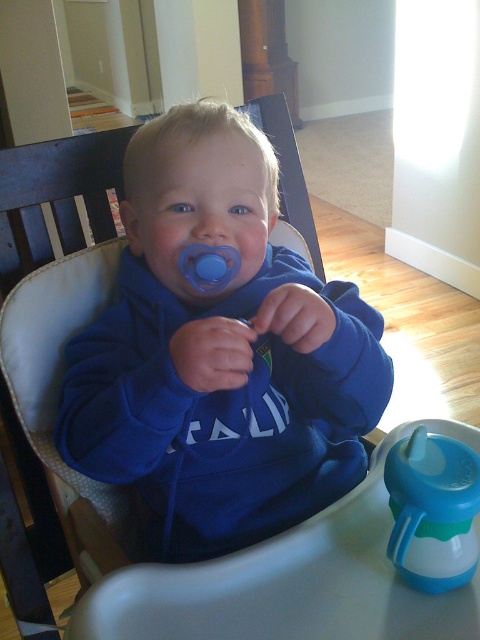
What is the color of the clothing item at the location marked by the point coordinates [219,353]?

The point coordinates [219,353] are on the blue fleece sweatshirt at center, so the color is blue.